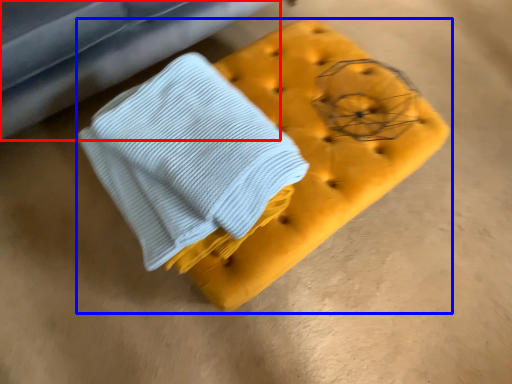
Question: Which point is closer to the camera, furniture (highlighted by a red box) or furniture (highlighted by a blue box)?

Choices:
 (A) furniture
 (B) furniture

Answer: (B)